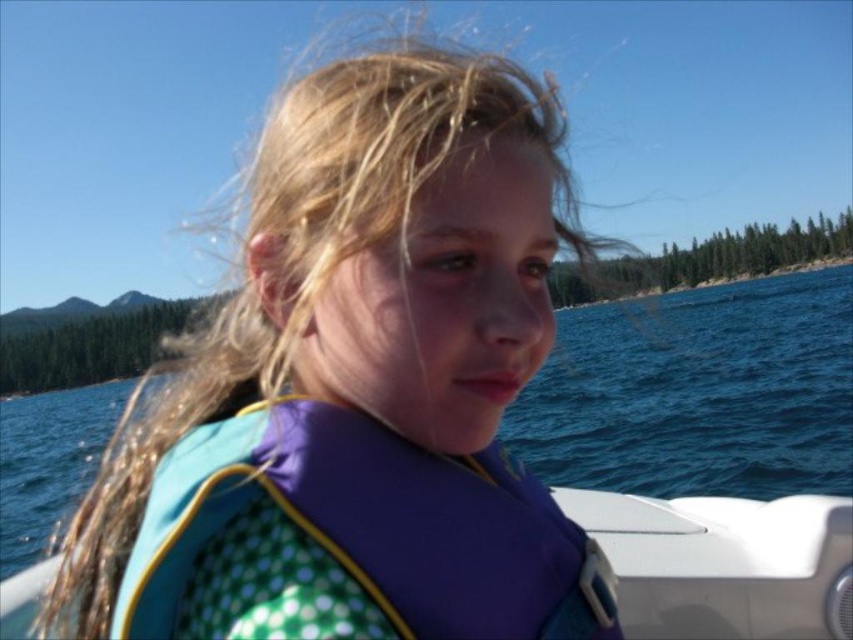
You are a lifeguard on duty and need to quickly identify the taller of the two life jackets. Which one is taller between the blue polka dot life vest at center and the polka dot fabric life jacket at center?

The blue polka dot life vest at center is taller than the polka dot fabric life jacket at center.

You are a photographer trying to capture a wide shot of the blue polka dot life vest at center and the blue water at center. Given that the life vest is narrower than the water, which object should you focus on to ensure both are fully visible in the frame?

Since the blue polka dot life vest at center is narrower than the blue water at center, you should focus on the blue water at center to ensure both objects fit within the frame.

You are a photographer trying to capture the blue polka dot life vest at center and the polka dot fabric life jacket at center in a single shot. Which one should you focus on first if you want to ensure both are in frame?

The blue polka dot life vest at center is positioned on the left side of the polka dot fabric life jacket at center, so you should focus on the polka dot fabric life jacket at center first to ensure both are in frame.